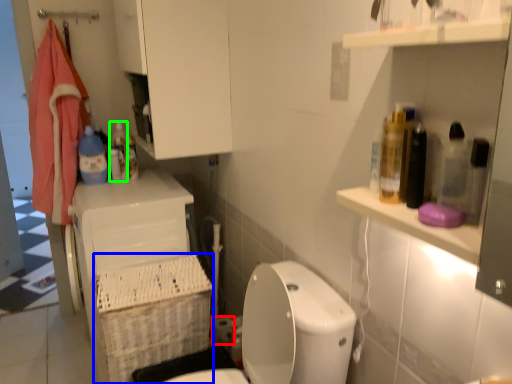
Question: Which object is the farthest from toilet paper (highlighted by a red box)? Choose among these: basket (highlighted by a blue box) or bottle (highlighted by a green box).

Choices:
 (A) basket
 (B) bottle

Answer: (B)